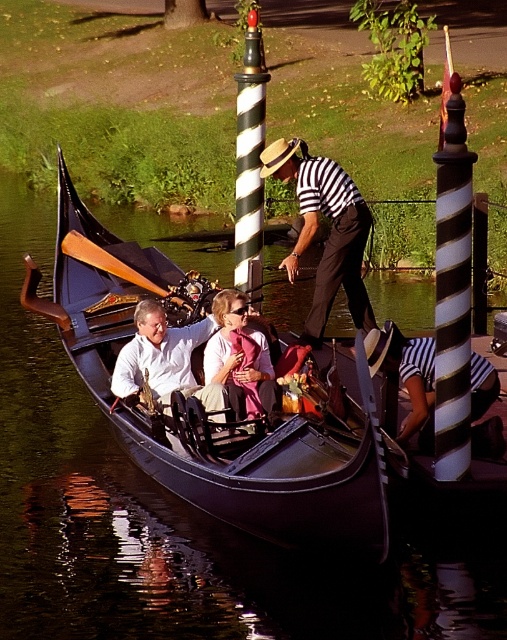
You are a passenger on the black polished wood gondola at center and notice a striped fabric referee at center nearby. Which object is taller from your perspective?

The black polished wood gondola at center is taller than the striped fabric referee at center.

You are a photographer planning to take a photo of the striped fabric referee at center and the pink fabric at center. Since you want both objects to be clearly visible in the frame, which object should you focus on first to ensure proper focus? Explain your reasoning based on their sizes.

The striped fabric referee at center has a larger width than the pink fabric at center. To ensure both are in focus, you should focus on the striped fabric referee at center first, as its larger size requires more precise focus to capture details, while the smaller pink fabric at center will naturally fall into the depth of field once the larger object is properly focused.

You are a passenger in the gondola and want to place a striped fabric referee at center. Where exactly should you place it?

The striped fabric referee at center should be placed at the coordinates point (329, 234).